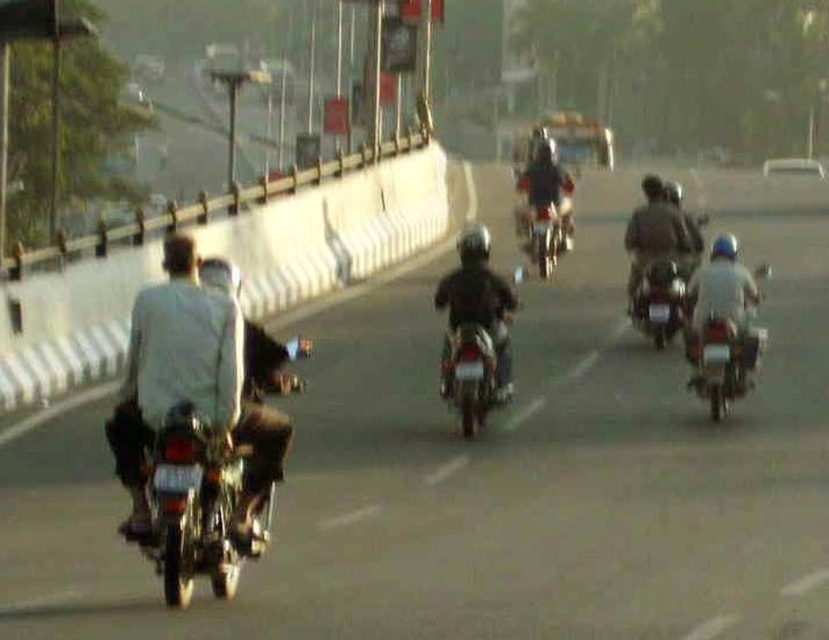
You are a photographer aiming to capture a photo of the dark brown leather jacket at center and the shiny chrome motorcycle at center. Since both are at the center, which one is positioned more to the right?

The dark brown leather jacket at center is positioned more to the right than the shiny chrome motorcycle at center.

You are a photographer who wants to capture a closeup of the dark brown leather jacket at center. Based on the scene description, where should you focus your camera to ensure the jacket is in focus?

The dark brown leather jacket at center is located at point (657,236) in the image, so you should focus your camera at that coordinate to ensure it is in focus.

You are a photographer who wants to capture a clear photo of the light gray fabric shirt at left and the shiny chrome motorcycle at center. Since the motorcycles are moving, you need to know which object is wider to adjust your camera settings. Which object has a greater width?

The light gray fabric shirt at left has a larger width than the shiny chrome motorcycle at center.